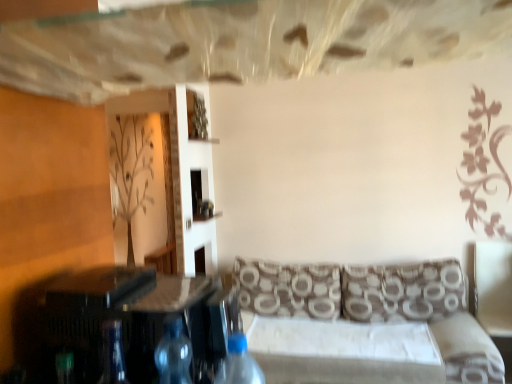
Question: Does brown printed cushion at right, placed as the second pillow when sorted from left to right, have a lesser width compared to transparent plastic bottle at center, which is the 2th bottle from right to left?

Choices:
 (A) no
 (B) yes

Answer: (A)

Question: From the image's perspective, would you say brown printed cushion at right, marked as the 1th pillow in a right-to-left arrangement, is positioned over transparent plastic bottle at center, which is the 2th bottle from right to left?

Choices:
 (A) yes
 (B) no

Answer: (B)

Question: Considering the relative sizes of brown printed cushion at right, placed as the second pillow when sorted from left to right, and transparent plastic bottle at center, arranged as the 1th bottle when viewed from the left, in the image provided, is brown printed cushion at right, placed as the second pillow when sorted from left to right, shorter than transparent plastic bottle at center, arranged as the 1th bottle when viewed from the left,?

Choices:
 (A) no
 (B) yes

Answer: (A)

Question: Would you say transparent plastic bottle at center, which is the 2th bottle from right to left, is part of brown printed cushion at right, marked as the 1th pillow in a right-to-left arrangement,'s contents?

Choices:
 (A) yes
 (B) no

Answer: (B)

Question: Is brown printed cushion at right, marked as the 1th pillow in a right-to-left arrangement, turned away from transparent plastic bottle at center, which is the 2th bottle from right to left?

Choices:
 (A) no
 (B) yes

Answer: (A)

Question: Is brown printed cushion at right, placed as the second pillow when sorted from left to right, further to camera compared to transparent plastic bottle at center, arranged as the 1th bottle when viewed from the left?

Choices:
 (A) no
 (B) yes

Answer: (B)

Question: From the image's perspective, would you say transparent glass table at center is positioned over brown wood plywood at left?

Choices:
 (A) yes
 (B) no

Answer: (B)

Question: Is transparent glass table at center bigger than brown wood plywood at left?

Choices:
 (A) no
 (B) yes

Answer: (A)

Question: Can brown wood plywood at left be found inside transparent glass table at center?

Choices:
 (A) yes
 (B) no

Answer: (B)

Question: Is brown wood plywood at left at the back of transparent glass table at center?

Choices:
 (A) no
 (B) yes

Answer: (B)

Question: Can we say transparent glass table at center lies outside brown wood plywood at left?

Choices:
 (A) no
 (B) yes

Answer: (B)

Question: Does transparent glass table at center come behind brown wood plywood at left?

Choices:
 (A) yes
 (B) no

Answer: (B)

Question: Considering the relative sizes of brown wood plywood at left and brown printed cushion at right, marked as the 1th pillow in a right-to-left arrangement, in the image provided, is brown wood plywood at left wider than brown printed cushion at right, marked as the 1th pillow in a right-to-left arrangement,?

Choices:
 (A) no
 (B) yes

Answer: (B)